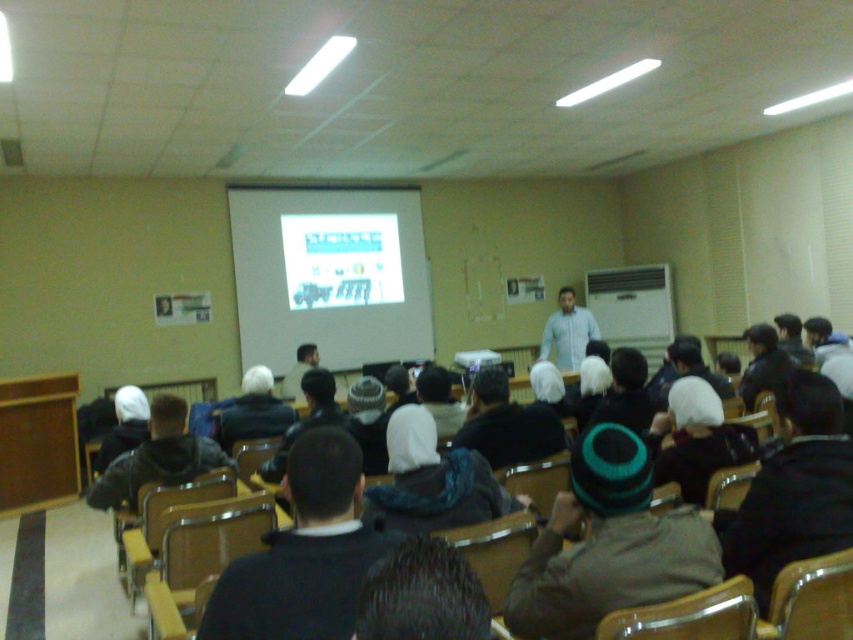
Question: Among these objects, which one is nearest to the camera?

Choices:
 (A) light brown knit cap at center
 (B) wooden at center
 (C) matte black projector at center

Answer: (B)

Question: Which point is farther from the camera taking this photo?

Choices:
 (A) (334, 449)
 (B) (242, 236)

Answer: (B)

Question: Based on their relative distances, which object is farther from the metallic yellow chair at lower right?

Choices:
 (A) dark gray knit cap at center
 (B) dark gray knit cap at lower right
 (C) white matte projection screen at upper center
 (D) white shirt at center

Answer: (C)

Question: Is the position of white matte projection screen at upper center less distant than that of dark blue hoodie at center?

Choices:
 (A) no
 (B) yes

Answer: (A)

Question: From the image, what is the correct spatial relationship of dark gray knit cap at lower right in relation to matte black projector at center?

Choices:
 (A) below
 (B) above

Answer: (A)

Question: Can you confirm if white matte projection screen at upper center is wider than light brown knit cap at center?

Choices:
 (A) yes
 (B) no

Answer: (A)